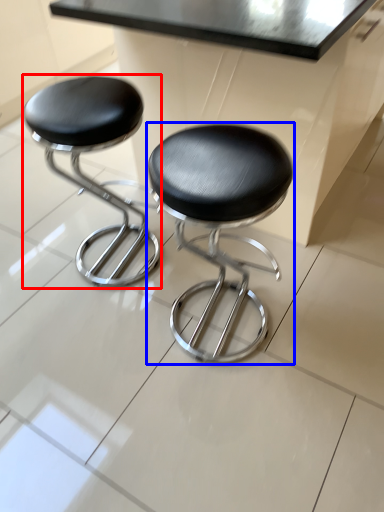
Question: Which object appears farthest to the camera in this image, stool (highlighted by a red box) or stool (highlighted by a blue box)?

Choices:
 (A) stool
 (B) stool

Answer: (A)